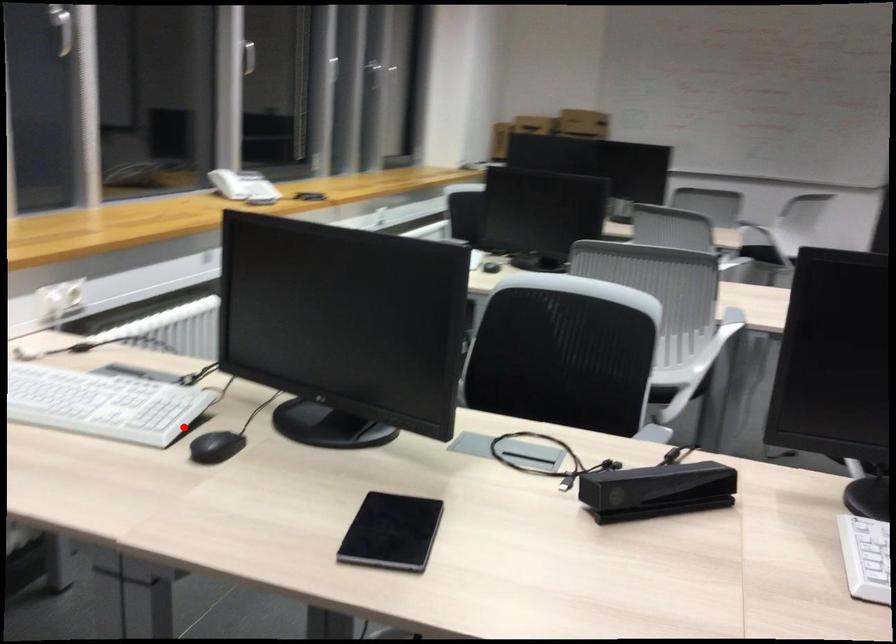
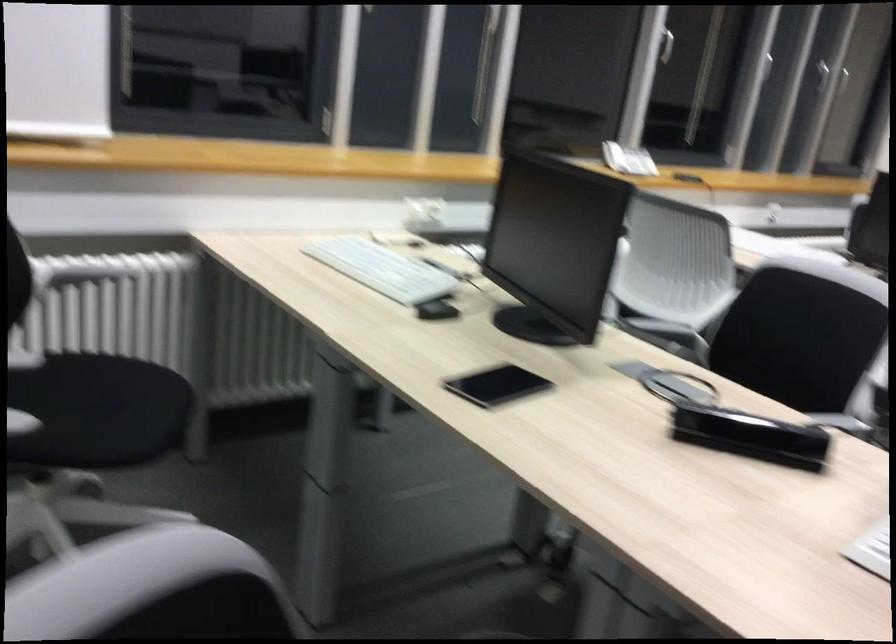
Where in the second image is the point corresponding to the highlighted location from the first image?

(435, 297)